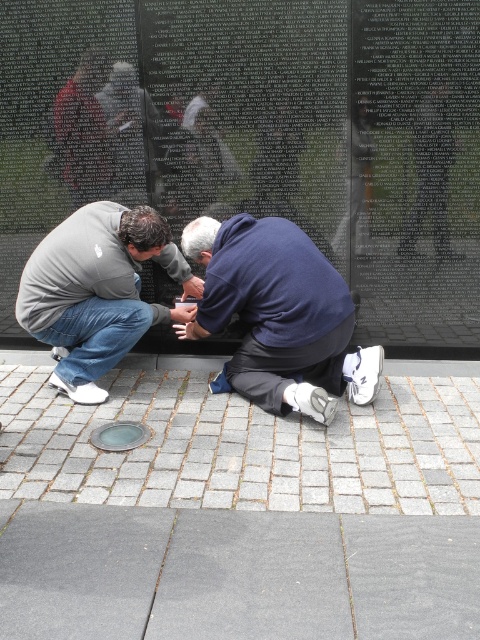
You are standing at the memorial wall and see the gray concrete pavement at lower center and the blue fabric at center. Which object is positioned to the left of the other?

The gray concrete pavement at lower center is to the left of blue fabric at center according to the description.

You are a photographer standing at the memorial wall. You want to capture a photo of the gray brick pavement at lower center and the blue fabric at center in the same frame. Given that your camera has a minimum focus distance of 20 inches, will you be able to focus on both objects simultaneously?

The distance between the gray brick pavement at lower center and the blue fabric at center is 20.93 inches, which exceeds the camera minimum focus distance of 20 inches. Therefore, the camera can focus on both objects simultaneously.

You are standing at the memorial wall and notice two points marked on the ground. The first point is at coordinates point (251, 384) and the second is at point (187, 272). If you were to walk from the first point to the second, would you be moving forward or backward relative to your current position?

The point (251, 384) is in front of point (187, 272), so walking from the first to the second point would mean moving backward relative to your current position.